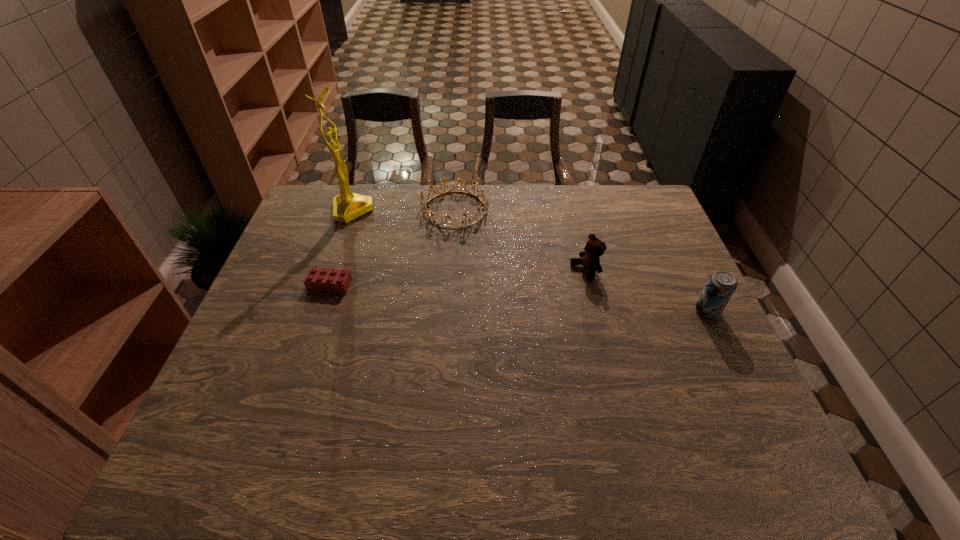
What are the coordinates of `free space located 0.110m on the front-facing side of the tiara` in the screenshot? It's located at (479, 251).

Find the location of a particular element. vacant space located 0.130m on the front-facing side of the tiara is located at coordinates (482, 255).

Where is `vacant space located on the front-facing side of the teddy bear`? This screenshot has height=540, width=960. vacant space located on the front-facing side of the teddy bear is located at coordinates (508, 306).

Where is `vacant region located on the front-facing side of the teddy bear`? The height and width of the screenshot is (540, 960). vacant region located on the front-facing side of the teddy bear is located at coordinates (533, 295).

I want to click on blank area located on the front-facing side of the teddy bear, so click(x=554, y=286).

At what (x,y) coordinates should I click in order to perform the action: click on vacant space located 0.280m on the front-facing side of the tallest object. Please return your answer as a coordinate pair (x, y). The width and height of the screenshot is (960, 540). Looking at the image, I should click on (424, 259).

You are a GUI agent. You are given a task and a screenshot of the screen. Output one action in this format:
    pyautogui.click(x=<x>, y=<y>)
    Task: Click on the blank space located on the front-facing side of the tallest object
    
    Given the screenshot: What is the action you would take?
    tap(442, 269)

The height and width of the screenshot is (540, 960). Find the location of `free location located 0.400m on the front-facing side of the tallest object`. free location located 0.400m on the front-facing side of the tallest object is located at coordinates (454, 278).

Locate an element on the screen. tiara located at the far edge is located at coordinates (485, 203).

The width and height of the screenshot is (960, 540). I want to click on award located at the far edge, so click(x=347, y=206).